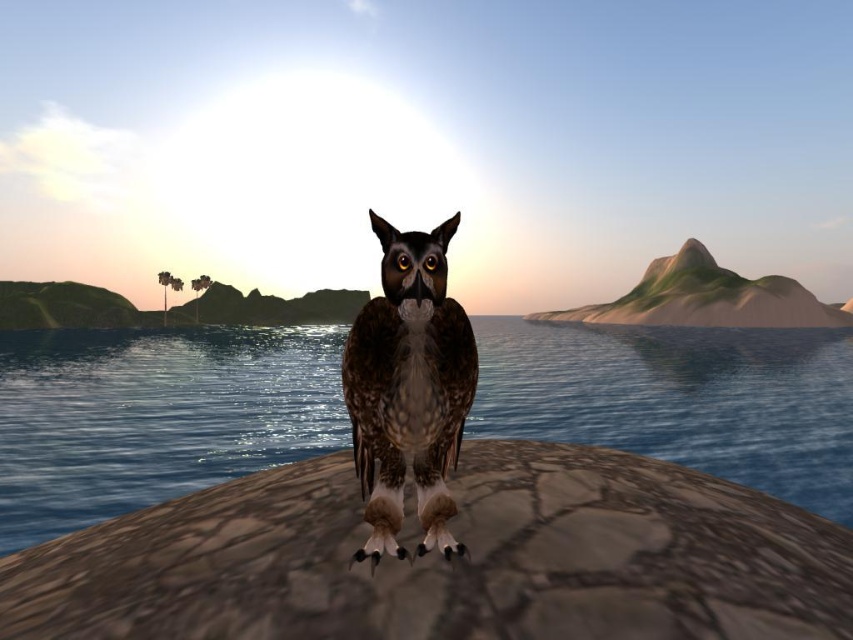
You are an ornithologist observing the owl in the image. You notice the blue water at center and the brown speckled feathers at center. Which object is positioned lower in the scene?

The blue water at center is positioned below the brown speckled feathers at center, so the blue water at center is lower in the scene.

You are an ornithologist observing the owl in the scene. You notice the brown speckled feathers at center and the brown rough stone at center. Which object is closer to the observer?

The brown rough stone at center is closer to the observer because the brown speckled feathers at center are positioned behind it.

You are a photographer trying to capture the owl in the scene. You need to decide whether to focus on the brown rough stone at center or the blue water at center for the background. Which object is narrower in width so that it won

The brown rough stone at center is thinner than the blue water at center, so it is narrower in width. Therefore, focusing on the brown rough stone at center would be better for a narrower background focus.